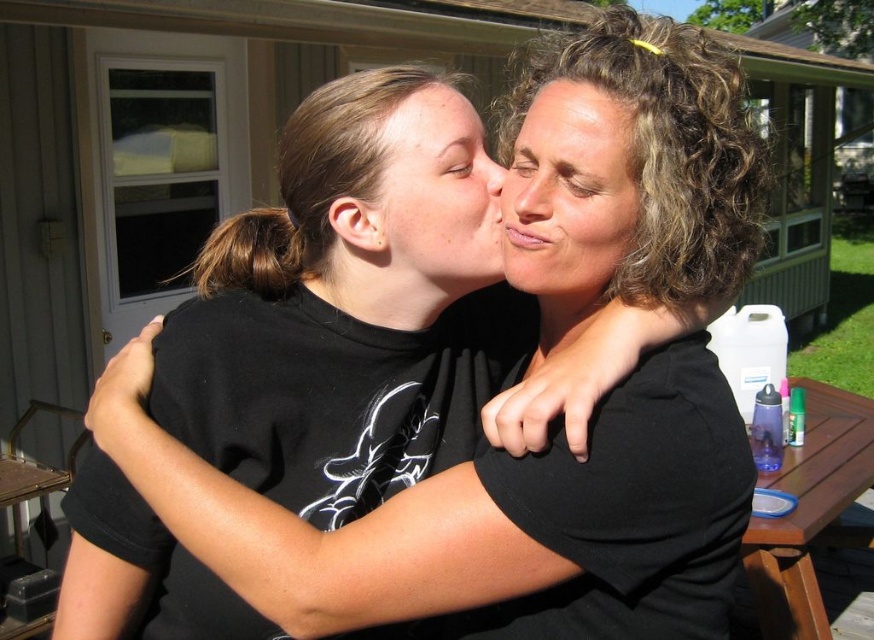
You are a photographer setting up a camera at point (435,195). What object would be in your camera frame at that exact point?

The matte black face at center is located at point (435,195), so the camera frame at that point would capture the matte black face at center.